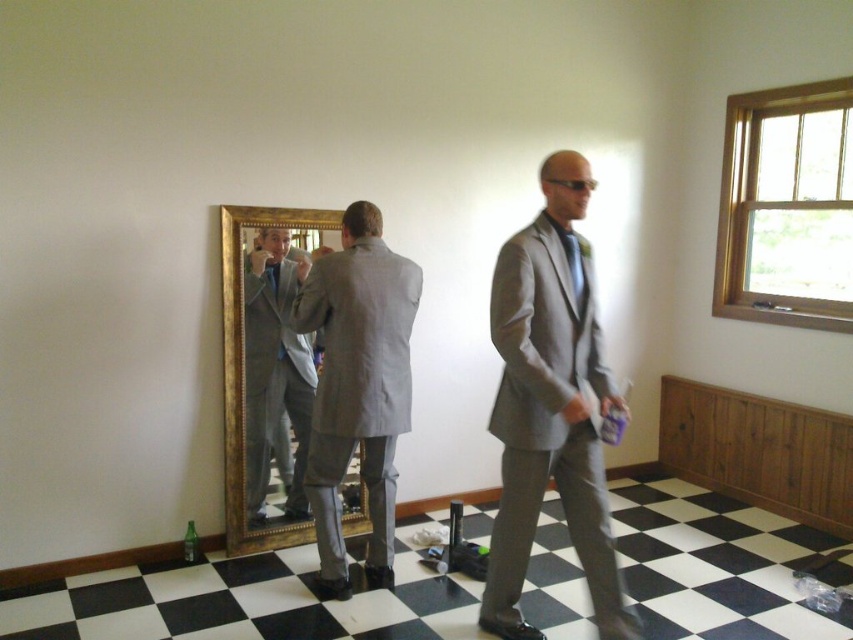
Question: Which point appears farthest from the camera in this image?

Choices:
 (A) (364, 531)
 (B) (602, 518)

Answer: (A)

Question: Can you confirm if matte gray suit at center is positioned to the right of green silk tie at center?

Choices:
 (A) no
 (B) yes

Answer: (A)

Question: Which object is positioned closest to the green silk tie at center?

Choices:
 (A) matte gray suit at center
 (B) gray matte suit at center
 (C) gray fabric suit at center
 (D) gold-framed mirror at center

Answer: (A)

Question: Observing the image, what is the correct spatial positioning of matte gray suit at center in reference to gray fabric suit at center?

Choices:
 (A) right
 (B) left

Answer: (A)

Question: Among these points, which one is nearest to the camera?

Choices:
 (A) (566, 333)
 (B) (280, 236)
 (C) (251, 228)

Answer: (A)

Question: Observing the image, what is the correct spatial positioning of matte gray suit at center in reference to green silk tie at center?

Choices:
 (A) above
 (B) below

Answer: (B)